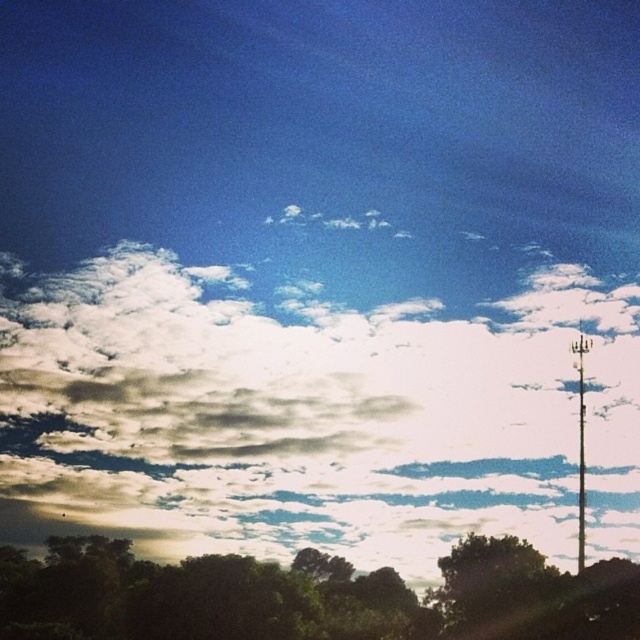
You are an architect designing a new observation deck. You want to ensure visitors can see both the white fluffy cloud at upper center and the metallic pole at right from the deck. Given their sizes, which object will appear larger in the viewfinder of your camera when taking a photo from the deck?

The white fluffy cloud at upper center will appear larger in the viewfinder because its width is larger than that of the metallic pole at right.